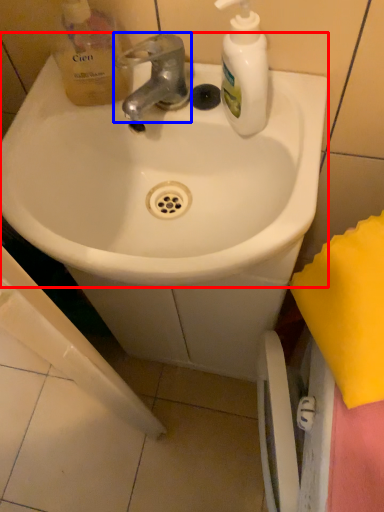
Question: Among these objects, which one is nearest to the camera, sink (highlighted by a red box) or tap (highlighted by a blue box)?

Choices:
 (A) sink
 (B) tap

Answer: (A)